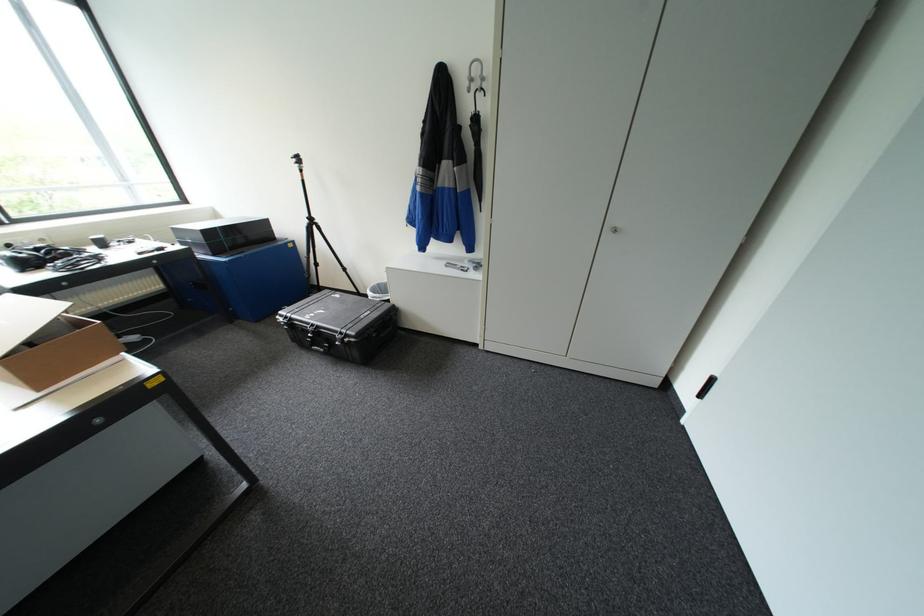
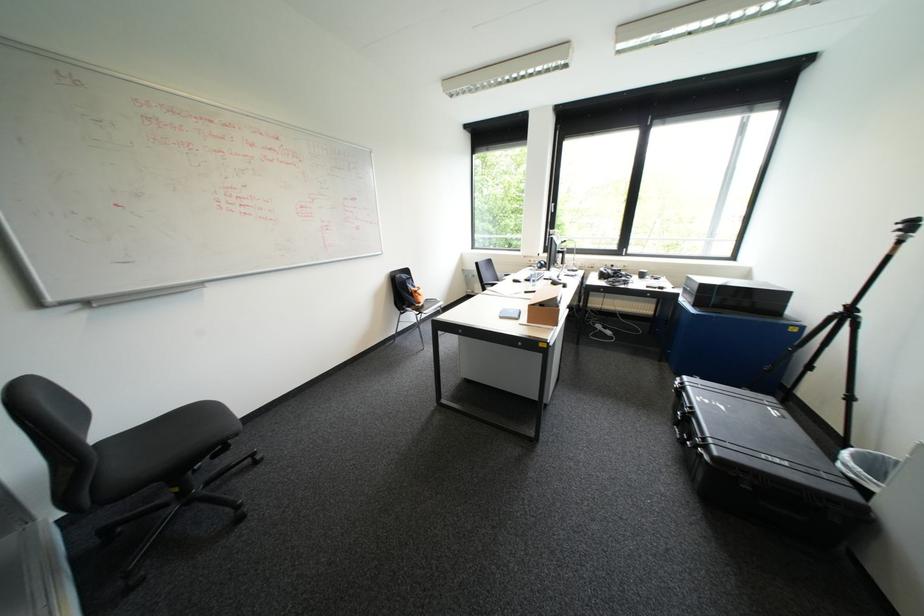
Find the pixel in the second image that matches the point at 345,342 in the first image.

(697, 440)